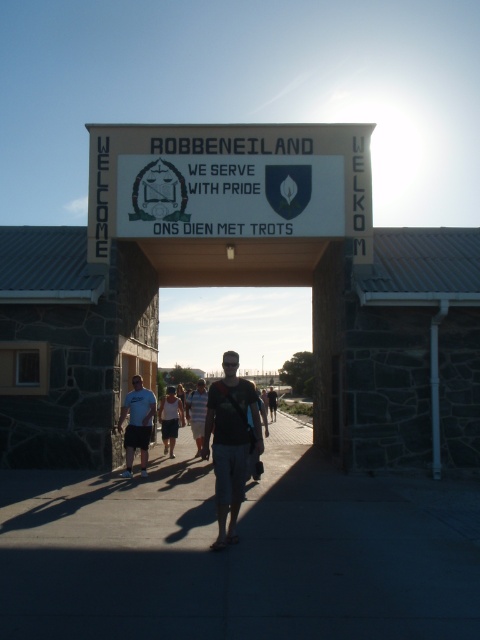
Question: Considering the real-world distances, which object is farthest from the dark blue t-shirt at center?

Choices:
 (A) white paper sign at center
 (B) dark fabric backpack at center
 (C) light blue denim shorts at center

Answer: (B)

Question: In this image, where is dark blue t-shirt at center located relative to dark brown leather backpack at center?

Choices:
 (A) below
 (B) above

Answer: (B)

Question: Is white cotton t-shirt at center behind dark brown leather backpack at center?

Choices:
 (A) yes
 (B) no

Answer: (B)

Question: Can you confirm if dark fabric backpack at center is bigger than dark brown leather backpack at center?

Choices:
 (A) yes
 (B) no

Answer: (B)

Question: Estimate the real-world distances between objects in this image. Which object is closer to the white cotton t-shirt at center?

Choices:
 (A) dark fabric backpack at center
 (B) dark blue t-shirt at center
 (C) white paper sign at center

Answer: (A)

Question: Which object is farther from the camera taking this photo?

Choices:
 (A) dark blue t-shirt at center
 (B) light blue denim shorts at center
 (C) dark fabric backpack at center
 (D) white cotton t-shirt at center

Answer: (B)